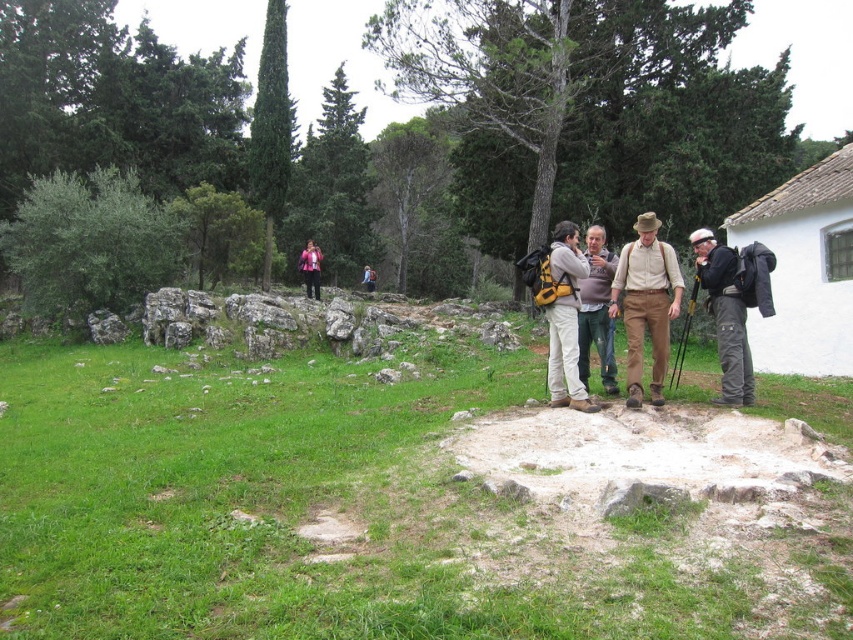
You are a photographer trying to capture a group photo of the khaki cotton pants at center and the pink fabric jacket at center. To ensure both are in frame, should you position yourself to the left or right of the group?

You should position yourself to the left of the group because the khaki cotton pants at center is to the right of the pink fabric jacket at center, so placing yourself to the left will keep both in the frame.

You are a photographer trying to capture a candid shot of the khaki cotton pants at center and the pink fabric jacket at center in the group. Since you want both to be clearly visible in the frame, which object should you focus on to ensure the smaller one is in focus?

You should focus on the khaki cotton pants at center because it has a smaller size compared to the pink fabric jacket at center, ensuring it is in focus.

You are planning to place a rectangular object that is 1 meter wide on the ground. You have two options for placement areas based on the objects in the scene. The first area is near the black backpack at right, and the second is near the light pink fabric at center. Which area has a wider space available for placement?

The light pink fabric at center has a wider space available because the black backpack at right is narrower than the light pink fabric at center according to the description.